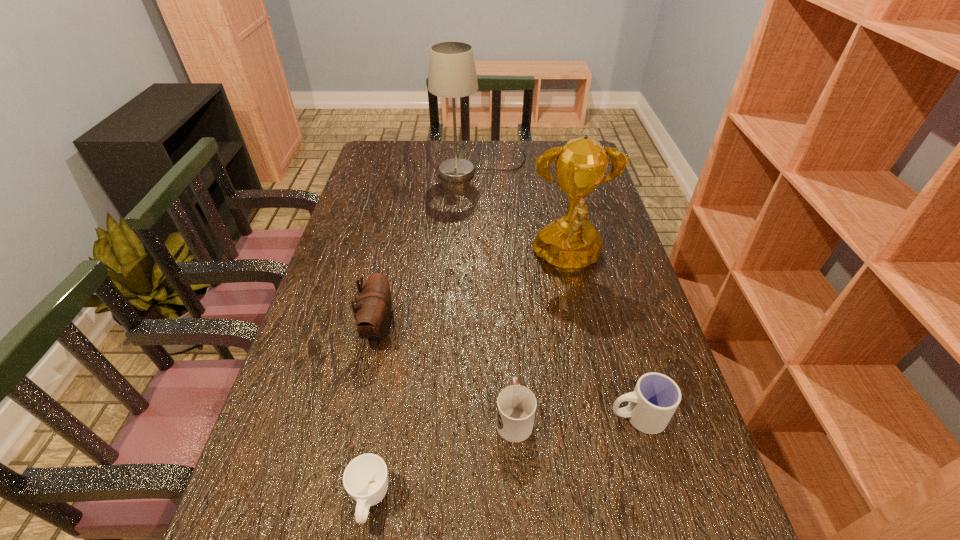
The image size is (960, 540). In order to click on free area in between the second cup from right to left and the tallest object in this screenshot , I will do `click(497, 293)`.

In order to click on empty space that is in between the leftmost cup and the fourth nearest object in this screenshot , I will do `click(375, 414)`.

Image resolution: width=960 pixels, height=540 pixels. I want to click on unoccupied position between the tallest object and the second cup from right to left, so click(497, 293).

You are a GUI agent. You are given a task and a screenshot of the screen. Output one action in this format:
    pyautogui.click(x=<x>, y=<y>)
    Task: Click on the vacant space that's between the table lamp and the rightmost cup
    Image resolution: width=960 pixels, height=540 pixels.
    Given the screenshot: What is the action you would take?
    pyautogui.click(x=560, y=292)

Identify the location of blank region between the nearest cup and the rightmost cup. The image size is (960, 540). tap(504, 458).

Where is `free spot between the farthest object and the nearest cup`? This screenshot has width=960, height=540. free spot between the farthest object and the nearest cup is located at coordinates (426, 335).

The height and width of the screenshot is (540, 960). In order to click on object that stands as the fourth closest to the farthest object in this screenshot , I will do 655,398.

Locate which object ranks fifth in proximity to the leftmost cup. Please provide its 2D coordinates. Your answer should be formatted as a tuple, i.e. [(x, y)], where the tuple contains the x and y coordinates of a point satisfying the conditions above.

[(452, 73)]

What are the coordinates of `cup that is the third closest one to the fifth shortest object` in the screenshot? It's located at (365, 479).

Locate an element on the screen. The width and height of the screenshot is (960, 540). cup identified as the third closest to the award is located at coordinates (365, 479).